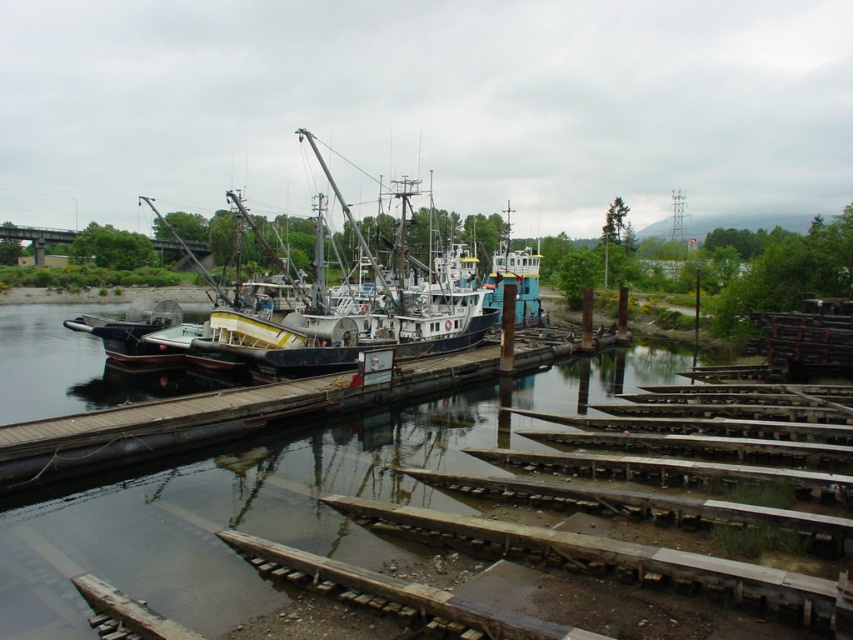
Question: Which point is closer to the camera taking this photo?

Choices:
 (A) (224, 369)
 (B) (212, 420)
 (C) (36, 614)

Answer: (C)

Question: Can you confirm if transparent water at center is wider than wooden at center?

Choices:
 (A) no
 (B) yes

Answer: (A)

Question: Does transparent water at center appear over brushed metal boat at center?

Choices:
 (A) no
 (B) yes

Answer: (A)

Question: Observing the image, what is the correct spatial positioning of wooden at center in reference to brushed metal boat at center?

Choices:
 (A) above
 (B) below

Answer: (B)

Question: Among these points, which one is nearest to the camera?

Choices:
 (A) (387, 547)
 (B) (488, 323)
 (C) (515, 356)

Answer: (A)

Question: Which is nearer to the brushed metal boat at center?

Choices:
 (A) wooden at center
 (B) transparent water at center

Answer: (A)